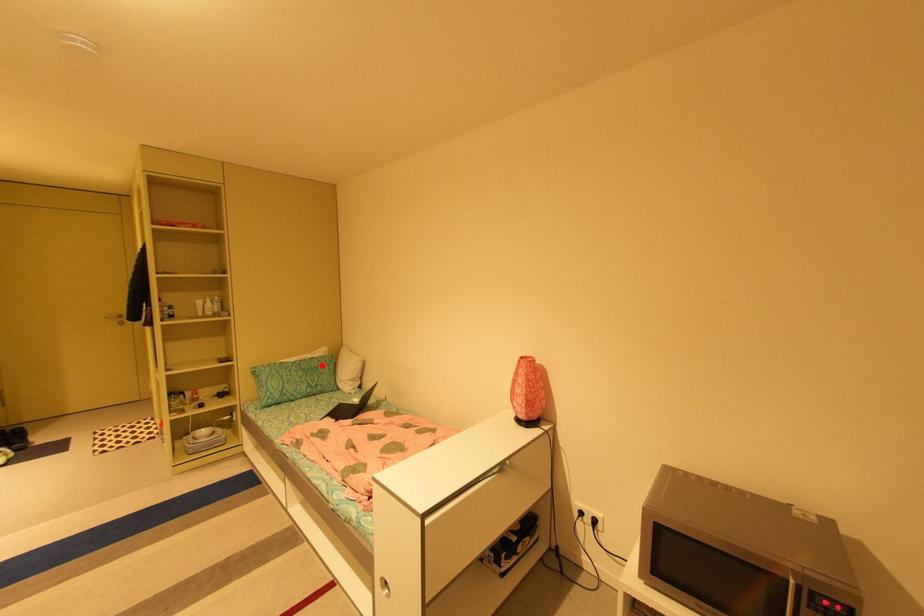
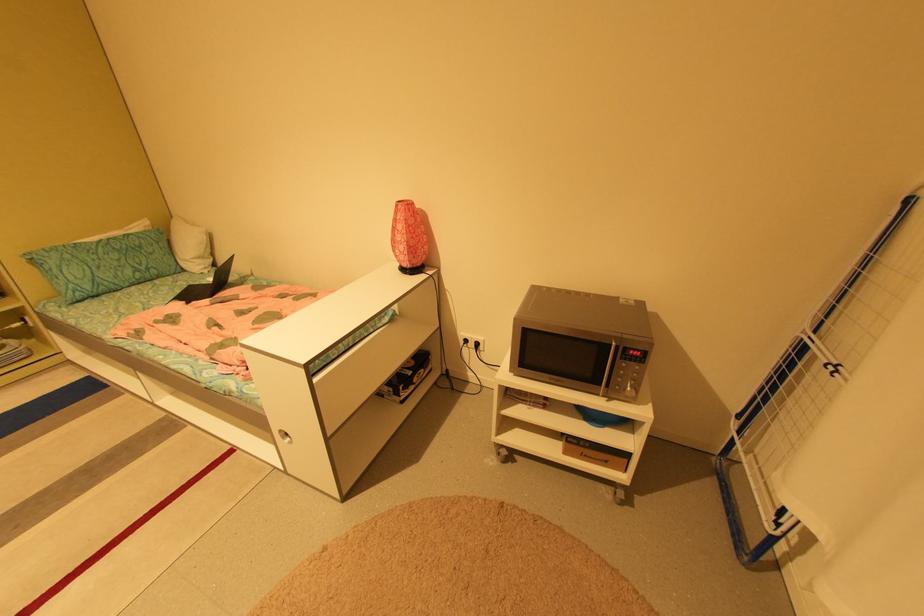
In the second image, find the point that corresponds to the highlighted location in the first image.

(142, 244)